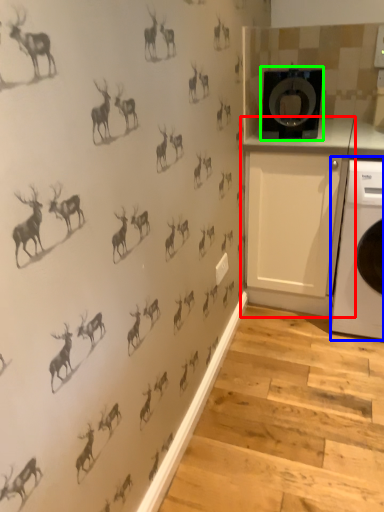
Question: Which object is positioned closest to cabinetry (highlighted by a red box)? Select from home appliance (highlighted by a blue box) and washing machine (highlighted by a green box).

Choices:
 (A) home appliance
 (B) washing machine

Answer: (A)